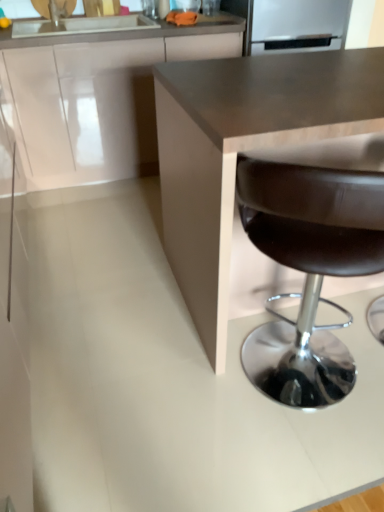
You are a GUI agent. You are given a task and a screenshot of the screen. Output one action in this format:
    pyautogui.click(x=<x>, y=<y>)
    Task: Click on the free space above brown leather stool at lower right (from a real-world perspective)
    This screenshot has width=384, height=512.
    Given the screenshot: What is the action you would take?
    pyautogui.click(x=318, y=113)